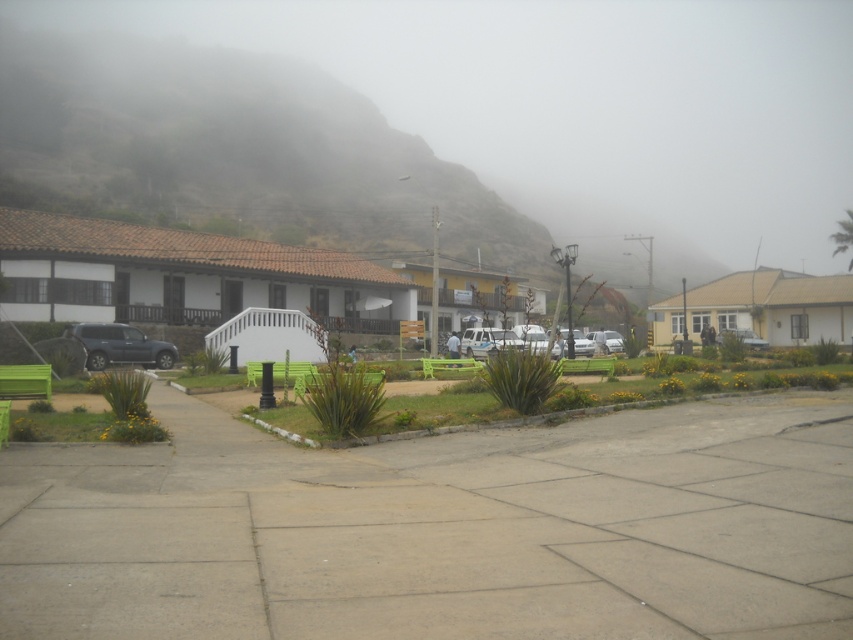
Question: Does white matte building at left appear over satin black suv at center?

Choices:
 (A) no
 (B) yes

Answer: (B)

Question: Is white matte building at left thinner than white matte building at center?

Choices:
 (A) no
 (B) yes

Answer: (A)

Question: Where is brown textured mountain at upper left located in relation to satin black suv at center in the image?

Choices:
 (A) below
 (B) above

Answer: (B)

Question: Among these points, which one is farthest from the camera?

Choices:
 (A) (140, 141)
 (B) (172, 364)
 (C) (753, 336)
 (D) (834, 296)

Answer: (A)

Question: Which of the following is the closest to the observer?

Choices:
 (A) (53, 230)
 (B) (103, 346)
 (C) (848, 314)
 (D) (486, 288)

Answer: (B)

Question: Which point is closer to the camera?

Choices:
 (A) (515, 304)
 (B) (184, 266)
 (C) (90, 365)

Answer: (A)